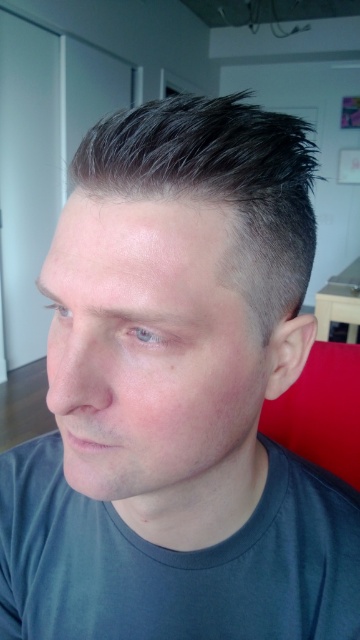
Is smooth skin head at center behind dark gray cotton t-shirt at lower center?

No, smooth skin head at center is in front of dark gray cotton t-shirt at lower center.

Who is taller, smooth skin head at center or dark gray cotton t-shirt at lower center?

Standing taller between the two is smooth skin head at center.

The image size is (360, 640). I want to click on smooth skin head at center, so click(x=178, y=300).

The image size is (360, 640). I want to click on smooth skin head at center, so click(x=178, y=300).